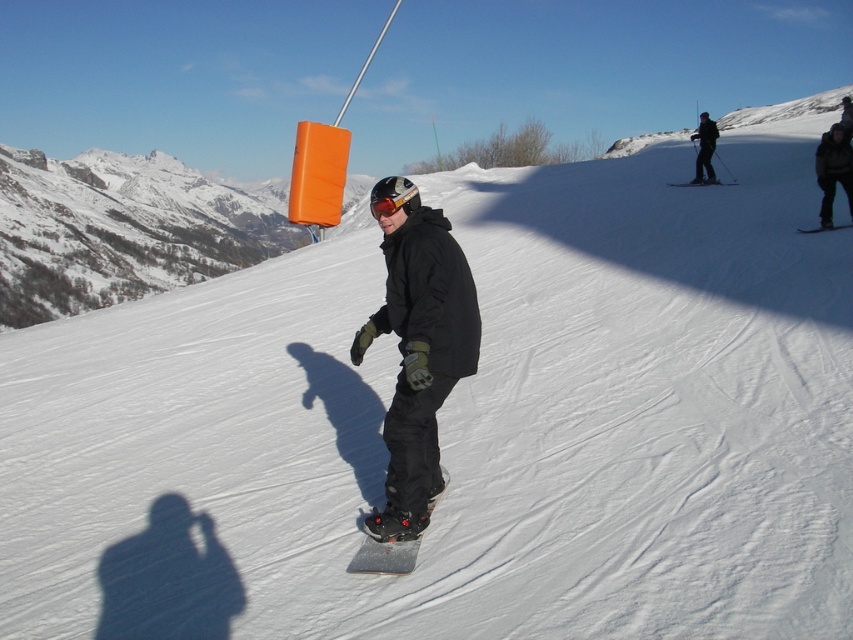
Question: Among these objects, which one is nearest to the camera?

Choices:
 (A) matte black snowboard at center
 (B) red reflective goggles at center
 (C) matte black snowboarder at center

Answer: (C)

Question: Does black matte snowboard at center appear on the left side of matte black snowboard at upper center?

Choices:
 (A) yes
 (B) no

Answer: (A)

Question: Does red reflective goggles at center appear over matte black snowboard at center?

Choices:
 (A) no
 (B) yes

Answer: (B)

Question: Which object is farther from the camera taking this photo?

Choices:
 (A) black matte snowboard at center
 (B) matte black snowboard at center
 (C) matte black snowboarder at center

Answer: (B)

Question: Which of the following is the farthest from the observer?

Choices:
 (A) (402, 401)
 (B) (398, 179)

Answer: (B)

Question: Does matte black snowboarder at center appear on the right side of matte black snowboard at center?

Choices:
 (A) yes
 (B) no

Answer: (B)